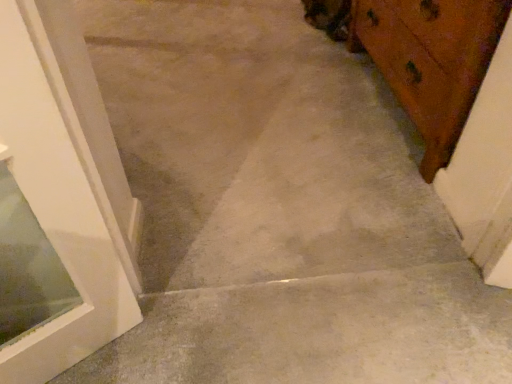
The image size is (512, 384). What do you see at coordinates (318, 332) in the screenshot?
I see `gray concrete at lower left` at bounding box center [318, 332].

Locate an element on the screen. Image resolution: width=512 pixels, height=384 pixels. gray concrete at lower left is located at coordinates (318, 332).

Where is `gray concrete at lower left`? gray concrete at lower left is located at coordinates (318, 332).